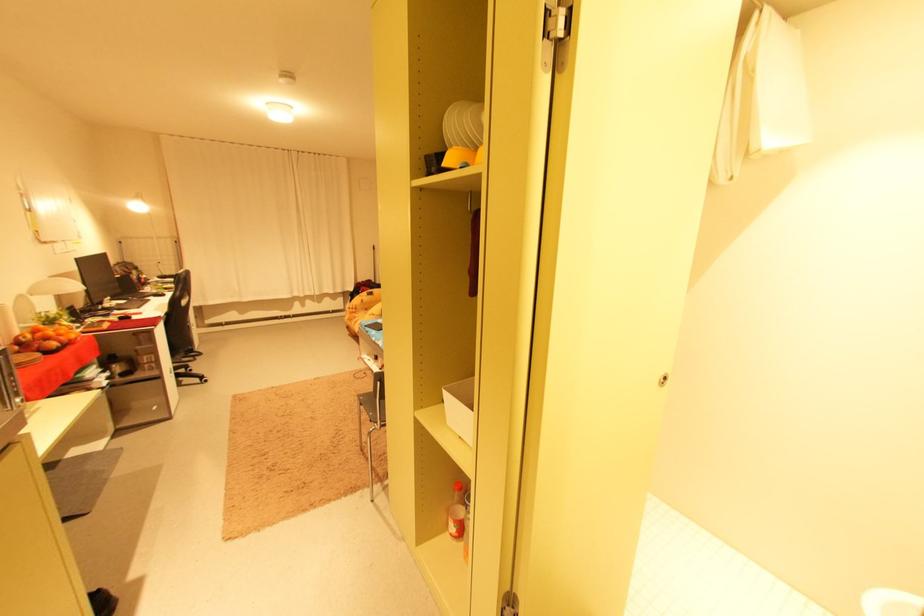
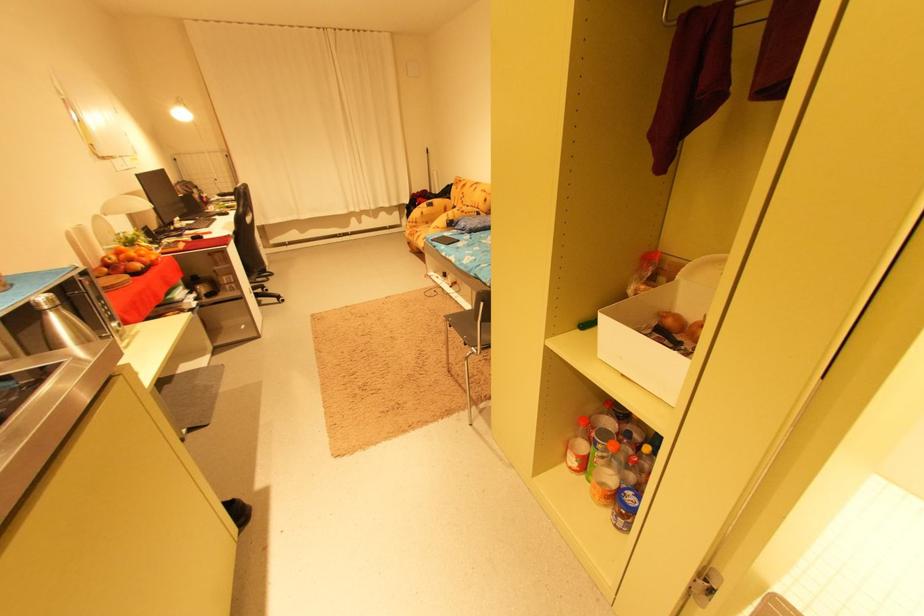
Where in the second image is the point corresponding to (467,438) from the first image?

(629, 376)